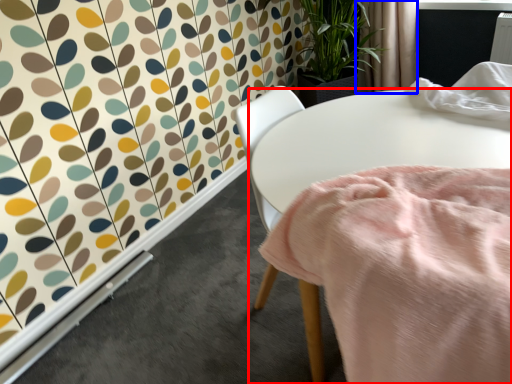
Question: Which object appears farthest to the camera in this image, table (highlighted by a red box) or curtain (highlighted by a blue box)?

Choices:
 (A) table
 (B) curtain

Answer: (B)